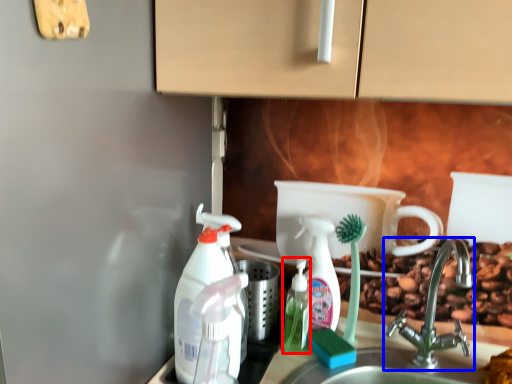
Question: Which object is further to the camera taking this photo, bottle (highlighted by a red box) or tap (highlighted by a blue box)?

Choices:
 (A) bottle
 (B) tap

Answer: (A)